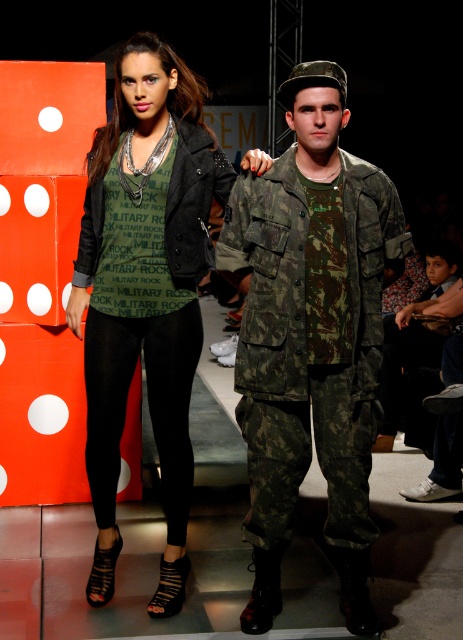
Question: Does camo fabric uniform at center lie behind matte black leggings at center?

Choices:
 (A) yes
 (B) no

Answer: (B)

Question: Can you confirm if camo fabric uniform at center is positioned above matte black leggings at center?

Choices:
 (A) no
 (B) yes

Answer: (A)

Question: Among these objects, which one is nearest to the camera?

Choices:
 (A) camo fabric uniform at center
 (B) matte black leggings at center

Answer: (A)

Question: Which point is farther from the camera taking this photo?

Choices:
 (A) (188, 337)
 (B) (251, 632)

Answer: (A)

Question: Among these objects, which one is farthest from the camera?

Choices:
 (A) matte black leggings at center
 (B) camo fabric uniform at center

Answer: (A)

Question: Does camo fabric uniform at center appear on the right side of matte black leggings at center?

Choices:
 (A) no
 (B) yes

Answer: (B)